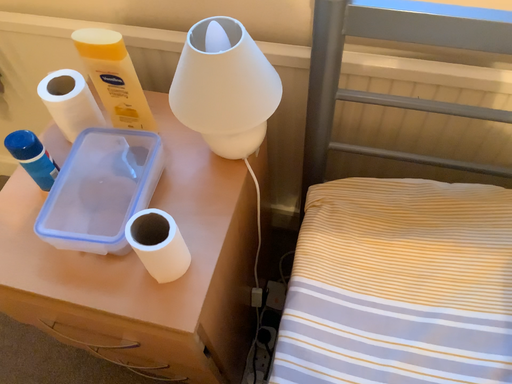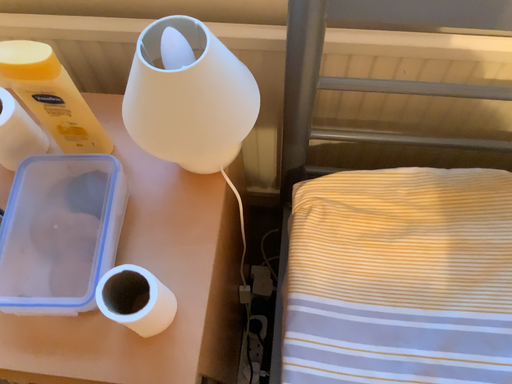
Question: How did the camera likely rotate when shooting the video?

Choices:
 (A) rotated downward
 (B) rotated upward

Answer: (A)